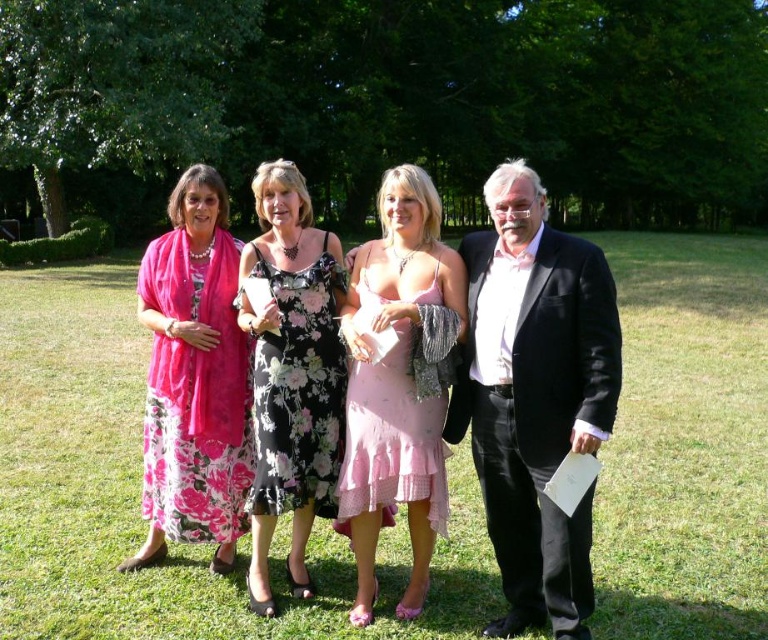
Question: Does black satin suit at right have a smaller size compared to pink floral dress at left?

Choices:
 (A) yes
 (B) no

Answer: (A)

Question: In this image, where is black satin suit at right located relative to pink chiffon dress at center?

Choices:
 (A) above
 (B) below

Answer: (B)

Question: Among these objects, which one is nearest to the camera?

Choices:
 (A) black satin suit at right
 (B) pink floral dress at left
 (C) floral-patterned fabric dress at center

Answer: (A)

Question: Which point appears farthest from the camera in this image?

Choices:
 (A) (154, 426)
 (B) (260, 394)

Answer: (A)

Question: Does floral-patterned fabric dress at center lie in front of pink chiffon dress at center?

Choices:
 (A) no
 (B) yes

Answer: (A)

Question: Which of the following is the farthest from the observer?

Choices:
 (A) (154, 545)
 (B) (310, 317)
 (C) (356, 499)

Answer: (A)